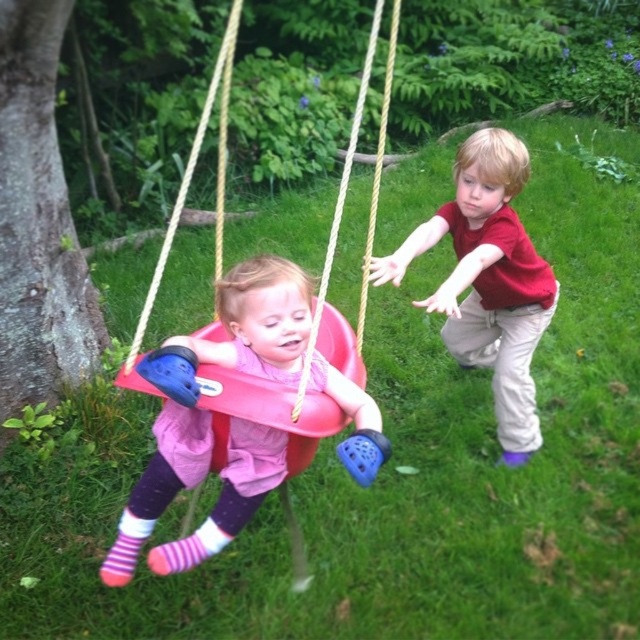
Can you confirm if smooth bark tree at left is smaller than matte red shirt at right?

Yes, smooth bark tree at left is smaller than matte red shirt at right.

Can you confirm if smooth bark tree at left is positioned above matte red shirt at right?

Indeed, smooth bark tree at left is positioned over matte red shirt at right.

Locate an element on the screen. The image size is (640, 640). smooth bark tree at left is located at coordinates (36, 221).

You are a GUI agent. You are given a task and a screenshot of the screen. Output one action in this format:
    pyautogui.click(x=<x>, y=<y>)
    Task: Click on the smooth bark tree at left
    This screenshot has width=640, height=640.
    Given the screenshot: What is the action you would take?
    pyautogui.click(x=36, y=221)

Does matte pink swing seat at center have a smaller size compared to matte red shirt at right?

Indeed, matte pink swing seat at center has a smaller size compared to matte red shirt at right.

Is matte pink swing seat at center further to camera compared to matte red shirt at right?

No, it is not.

What do you see at coordinates (198, 392) in the screenshot?
I see `matte pink swing seat at center` at bounding box center [198, 392].

This screenshot has height=640, width=640. What are the coordinates of `matte pink swing seat at center` in the screenshot? It's located at (198, 392).

At what (x,y) coordinates should I click in order to perform the action: click on matte red shirt at right. Please return your answer as a coordinate pair (x, y). Looking at the image, I should click on (488, 280).

Measure the distance between point (468, 301) and camera.

Point (468, 301) and camera are 3.57 meters apart.

Find the location of a particular element. This screenshot has width=640, height=640. matte red shirt at right is located at coordinates (488, 280).

I want to click on matte red shirt at right, so pos(488,280).